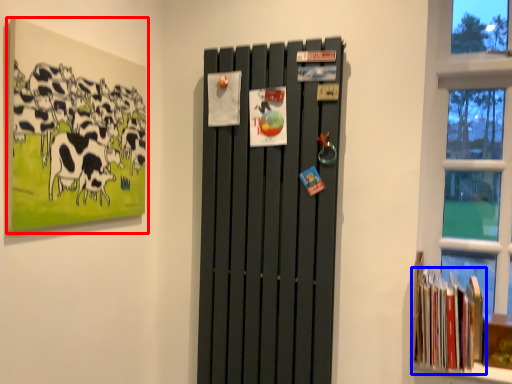
Question: Which object is further to the camera taking this photo, picture frame (highlighted by a red box) or book (highlighted by a blue box)?

Choices:
 (A) picture frame
 (B) book

Answer: (B)